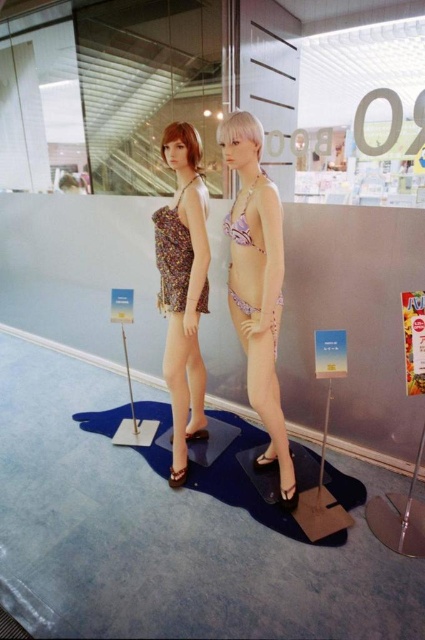
You are standing in a store and see two mannequins. One is wearing a sleeveless patterned dress and the other a bikini. There is a point marked at coordinates [257,282]. Which mannequin does this point belong to?

The point at coordinates [257,282] corresponds to the pink floral bikini at center.

You are a customer in a clothing store looking at the pink floral bikini at center and the printed fabric dress at center. Which item is shorter in height?

The pink floral bikini at center has a lesser height compared to the printed fabric dress at center, so the bikini is shorter in height.